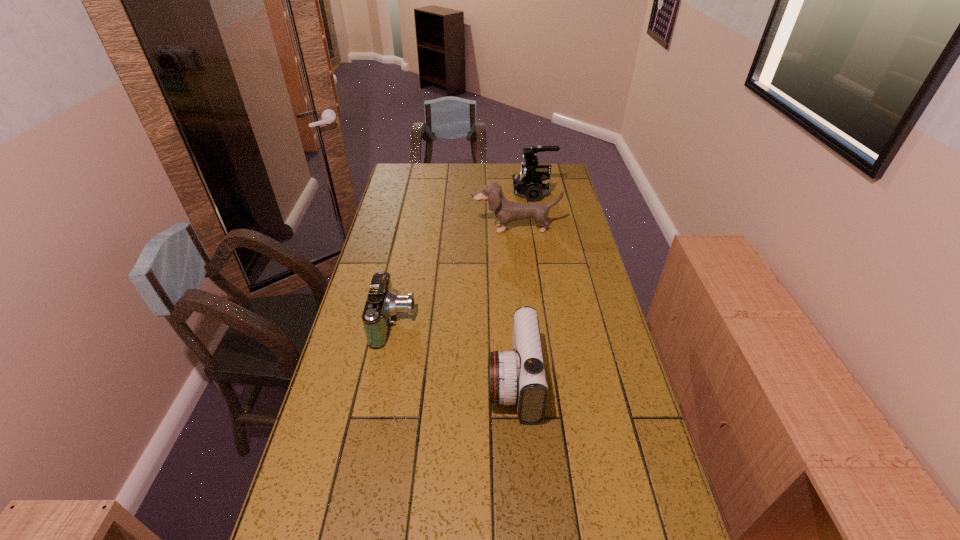
Identify the location of vacant region at the left edge. (353, 334).

This screenshot has width=960, height=540. In the image, there is a desktop. Identify the location of vacant space at the right edge. pos(668,495).

What are the coordinates of `vacant area at the far left corner of the desktop` in the screenshot? It's located at (406, 177).

At what (x,y) coordinates should I click in order to perform the action: click on unoccupied position between the shortest camcorder and the farthest camcorder. Please return your answer as a coordinate pair (x, y). The image size is (960, 540). Looking at the image, I should click on (464, 258).

Where is `vacant area that lies between the second tallest camcorder and the leftmost camcorder`? vacant area that lies between the second tallest camcorder and the leftmost camcorder is located at coordinates (454, 352).

Identify the location of vacant area between the shortest camcorder and the second shortest camcorder. (454, 352).

Identify the location of free space that is in between the leftmost camcorder and the farthest object. The width and height of the screenshot is (960, 540). (464, 258).

Where is `empty space that is in between the second farthest object and the leftmost object`? The height and width of the screenshot is (540, 960). empty space that is in between the second farthest object and the leftmost object is located at coordinates (455, 275).

Locate an element on the screen. This screenshot has height=540, width=960. vacant area that lies between the farthest camcorder and the shortest camcorder is located at coordinates (464, 258).

Identify the location of vacant area that lies between the farthest camcorder and the shortest object. Image resolution: width=960 pixels, height=540 pixels. (464, 258).